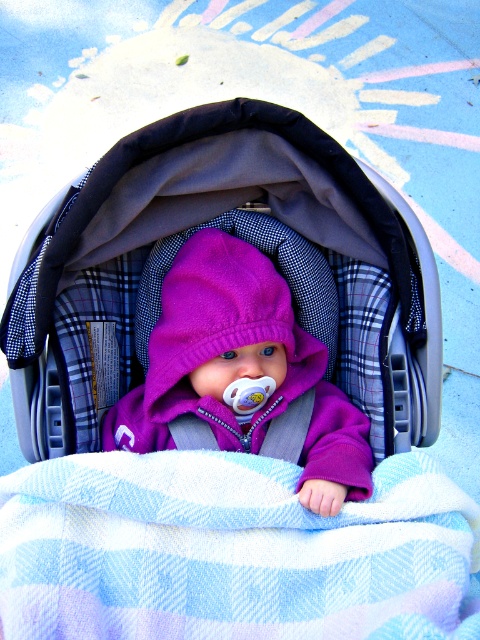
Question: Does plaid fabric baby carriage at center have a lesser width compared to purple fleece baby at center?

Choices:
 (A) yes
 (B) no

Answer: (B)

Question: Based on their relative distances, which object is farther from the purple fleece baby at center?

Choices:
 (A) plaid fabric baby carriage at center
 (B) blue striped blanket at center

Answer: (B)

Question: Does blue striped blanket at center appear over plaid fabric baby carriage at center?

Choices:
 (A) no
 (B) yes

Answer: (A)

Question: Can you confirm if blue striped blanket at center is positioned to the left of purple fleece baby at center?

Choices:
 (A) no
 (B) yes

Answer: (A)

Question: Which point is farther to the camera?

Choices:
 (A) plaid fabric baby carriage at center
 (B) blue striped blanket at center

Answer: (A)

Question: Which point appears closest to the camera in this image?

Choices:
 (A) (85, 177)
 (B) (244, 317)

Answer: (A)